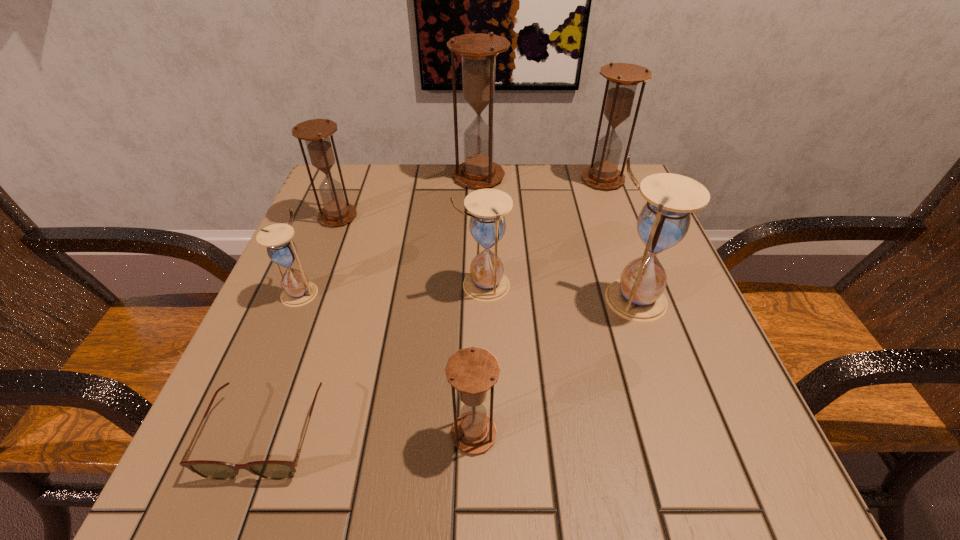
Locate an element on the screen. This screenshot has height=540, width=960. the shortest object is located at coordinates (269, 469).

I want to click on spectacles, so click(x=269, y=469).

This screenshot has height=540, width=960. Find the location of `vacant space positioned on the left of the tallest hourglass`. vacant space positioned on the left of the tallest hourglass is located at coordinates (386, 177).

Identify the location of vacant space located 0.210m on the front of the second biggest brown hourglass. The width and height of the screenshot is (960, 540). (628, 247).

Locate an element on the screen. vacant area located 0.240m on the left of the rightmost white hourglass is located at coordinates (470, 299).

Locate an element on the screen. free region located on the right of the sixth nearest object is located at coordinates (384, 217).

Where is `free space located on the left of the second white hourglass from right to left`? free space located on the left of the second white hourglass from right to left is located at coordinates (x=299, y=285).

Find the location of a particular element. This screenshot has height=540, width=960. vacant space located on the front of the smallest white hourglass is located at coordinates (216, 498).

Locate an element on the screen. free space located 0.060m on the right of the nearest hourglass is located at coordinates (540, 434).

What are the coordinates of `hourglass that is at the near edge` in the screenshot? It's located at (472, 371).